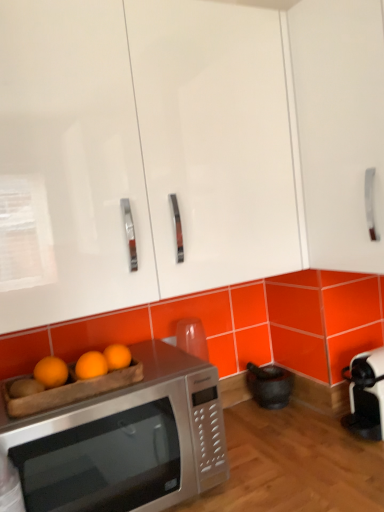
Question: Is satin silver microwave at lower left further to camera compared to white glossy cabinet at upper right, placed as the 1th cabinetry when sorted from right to left?

Choices:
 (A) yes
 (B) no

Answer: (B)

Question: Considering the relative sizes of satin silver microwave at lower left and white glossy cabinet at upper right, which appears as the second cabinetry when viewed from the left, in the image provided, is satin silver microwave at lower left bigger than white glossy cabinet at upper right, which appears as the second cabinetry when viewed from the left,?

Choices:
 (A) yes
 (B) no

Answer: (B)

Question: From a real-world perspective, is satin silver microwave at lower left below white glossy cabinet at upper right, which appears as the second cabinetry when viewed from the left?

Choices:
 (A) no
 (B) yes

Answer: (B)

Question: Does satin silver microwave at lower left have a lesser height compared to white glossy cabinet at upper right, placed as the 1th cabinetry when sorted from right to left?

Choices:
 (A) yes
 (B) no

Answer: (A)

Question: Is satin silver microwave at lower left closer to the viewer compared to white glossy cabinet at upper right, which appears as the second cabinetry when viewed from the left?

Choices:
 (A) no
 (B) yes

Answer: (B)

Question: From a real-world perspective, is satin silver microwave at lower left located higher than white glossy cabinet at upper right, placed as the 1th cabinetry when sorted from right to left?

Choices:
 (A) no
 (B) yes

Answer: (A)

Question: Is white glossy cabinet at upper right, which appears as the second cabinetry when viewed from the left, in front of white glossy cabinet at upper center, which is counted as the 1th cabinetry, starting from the left?

Choices:
 (A) yes
 (B) no

Answer: (B)

Question: From a real-world perspective, is white glossy cabinet at upper right, placed as the 1th cabinetry when sorted from right to left, under white glossy cabinet at upper center, which is counted as the 1th cabinetry, starting from the left?

Choices:
 (A) no
 (B) yes

Answer: (B)

Question: Is white glossy cabinet at upper right, placed as the 1th cabinetry when sorted from right to left, oriented away from white glossy cabinet at upper center, which is counted as the 1th cabinetry, starting from the left?

Choices:
 (A) yes
 (B) no

Answer: (B)

Question: Is white glossy cabinet at upper right, which appears as the second cabinetry when viewed from the left, surrounding white glossy cabinet at upper center, which is counted as the 1th cabinetry, starting from the left?

Choices:
 (A) yes
 (B) no

Answer: (B)

Question: Does white glossy cabinet at upper right, placed as the 1th cabinetry when sorted from right to left, turn towards white glossy cabinet at upper center, which is the 2th cabinetry from right to left?

Choices:
 (A) yes
 (B) no

Answer: (B)

Question: Considering the relative sizes of white glossy cabinet at upper right, placed as the 1th cabinetry when sorted from right to left, and white glossy cabinet at upper center, which is counted as the 1th cabinetry, starting from the left, in the image provided, is white glossy cabinet at upper right, placed as the 1th cabinetry when sorted from right to left, bigger than white glossy cabinet at upper center, which is counted as the 1th cabinetry, starting from the left,?

Choices:
 (A) no
 (B) yes

Answer: (A)

Question: Is orange matte wood tray at lower left not near satin silver microwave at lower left?

Choices:
 (A) no
 (B) yes

Answer: (A)